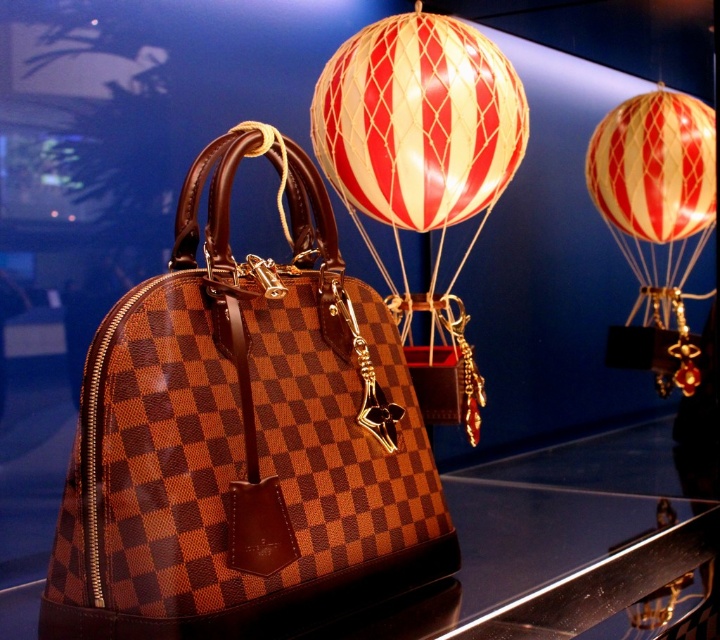
Question: Which of the following is the farthest from the observer?

Choices:
 (A) (603, 179)
 (B) (266, 618)

Answer: (A)

Question: Does brown checkered bag at center have a lesser width compared to red striped balloon at upper right?

Choices:
 (A) no
 (B) yes

Answer: (A)

Question: Estimate the real-world distances between objects in this image. Which object is farther from the transparent glass table at center?

Choices:
 (A) red striped balloon at upper right
 (B) brown checkered bag at center

Answer: (A)

Question: Which of these objects is positioned closest to the red and white striped balloon at upper center?

Choices:
 (A) brown checkered bag at center
 (B) red striped balloon at upper right
 (C) transparent glass table at center

Answer: (A)

Question: Can you confirm if brown checkered bag at center is bigger than red and white striped balloon at upper center?

Choices:
 (A) yes
 (B) no

Answer: (A)

Question: Can you confirm if red and white striped balloon at upper center is positioned to the left of red striped balloon at upper right?

Choices:
 (A) no
 (B) yes

Answer: (B)